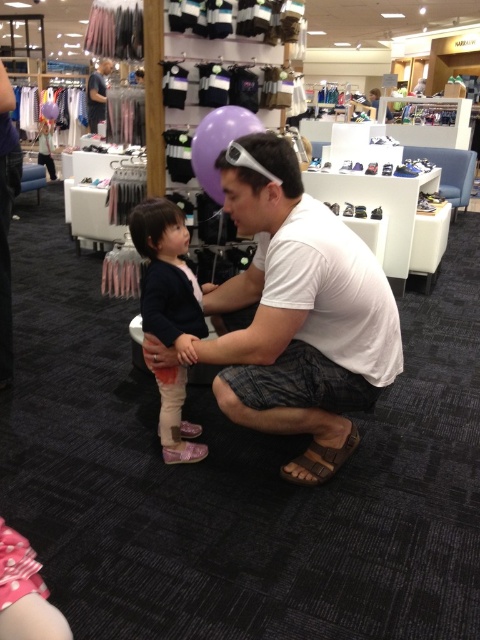
Question: Based on their relative distances, which object is farther from the white fabric shirt at center?

Choices:
 (A) dark blue shirt at upper left
 (B) matte dark blue sweater at center

Answer: (A)

Question: Is matte dark blue sweater at center closer to camera compared to dark blue shirt at upper left?

Choices:
 (A) yes
 (B) no

Answer: (A)

Question: Is matte dark blue sweater at center above dark blue shirt at upper left?

Choices:
 (A) yes
 (B) no

Answer: (B)

Question: Which object appears farthest from the camera in this image?

Choices:
 (A) dark blue shirt at upper left
 (B) white fabric shirt at center
 (C) brown leather sandal at lower center

Answer: (A)

Question: Which is nearer to the brown leather sandal at lower center?

Choices:
 (A) white fabric shirt at center
 (B) matte dark blue sweater at center

Answer: (A)

Question: Does brown leather sandal at lower center have a lesser width compared to dark blue shirt at upper left?

Choices:
 (A) yes
 (B) no

Answer: (A)